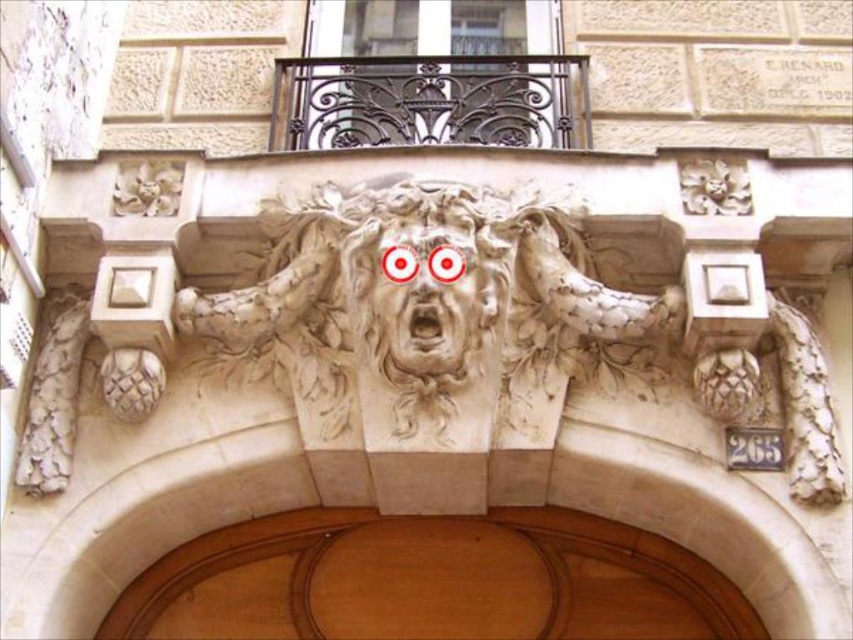
Question: Observing the image, what is the correct spatial positioning of white stone lion at center in reference to carved stone face at center?

Choices:
 (A) left
 (B) right

Answer: (B)

Question: Does wooden door at center lie in front of carved stone face at center?

Choices:
 (A) yes
 (B) no

Answer: (B)

Question: Which object is positioned closest to the white stone lion at center?

Choices:
 (A) carved stone face at center
 (B) wooden door at center

Answer: (A)

Question: Does white stone lion at center have a greater width compared to wooden door at center?

Choices:
 (A) no
 (B) yes

Answer: (A)

Question: Which point is closer to the camera taking this photo?

Choices:
 (A) [x=466, y=355]
 (B) [x=271, y=588]
 (C) [x=409, y=308]

Answer: (C)

Question: Which point is farther to the camera?

Choices:
 (A) (662, 564)
 (B) (573, 284)

Answer: (A)